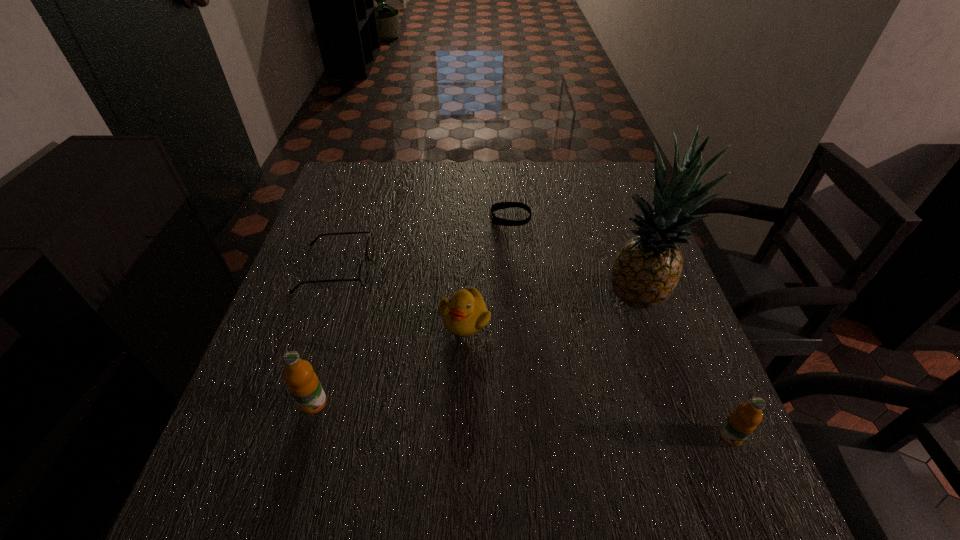
This screenshot has height=540, width=960. I want to click on the second nearest object, so click(303, 383).

This screenshot has height=540, width=960. Find the location of `the farther orange juice`. the farther orange juice is located at coordinates coord(303,383).

Where is `the nearest object`? The image size is (960, 540). the nearest object is located at coordinates (742, 422).

Where is `the right orange juice`? The image size is (960, 540). the right orange juice is located at coordinates (742, 422).

The image size is (960, 540). I want to click on the shortest object, so click(501, 205).

Where is `wristband`? The width and height of the screenshot is (960, 540). wristband is located at coordinates (501, 205).

You are a GUI agent. You are given a task and a screenshot of the screen. Output one action in this format:
    pyautogui.click(x=<x>, y=<y>)
    Task: Click on the tallest object
    The height and width of the screenshot is (540, 960).
    Given the screenshot: What is the action you would take?
    pyautogui.click(x=647, y=269)

The image size is (960, 540). I want to click on the fourth object from right to left, so click(465, 313).

At what (x,y) coordinates should I click in order to perform the action: click on the fourth tallest object. Please return your answer as a coordinate pair (x, y). Looking at the image, I should click on (465, 313).

Image resolution: width=960 pixels, height=540 pixels. Find the location of `spectacles`. spectacles is located at coordinates (363, 272).